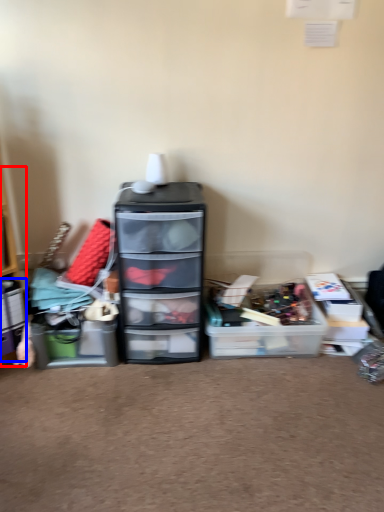
Question: Which point is closer to the camera, shelf (highlighted by a red box) or storage box (highlighted by a blue box)?

Choices:
 (A) shelf
 (B) storage box

Answer: (A)